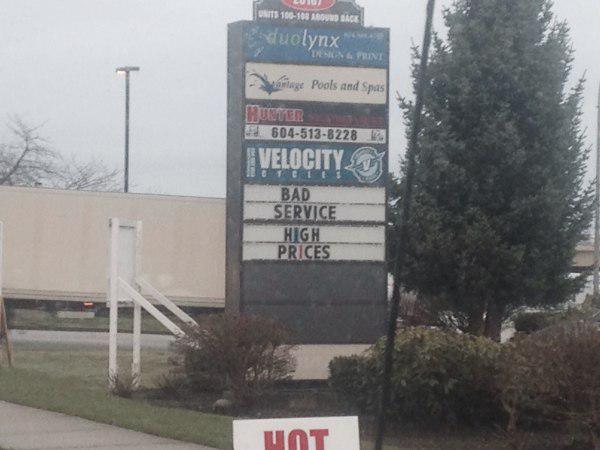
The width and height of the screenshot is (600, 450). Find the location of `grey panels`. grey panels is located at coordinates tap(348, 325).